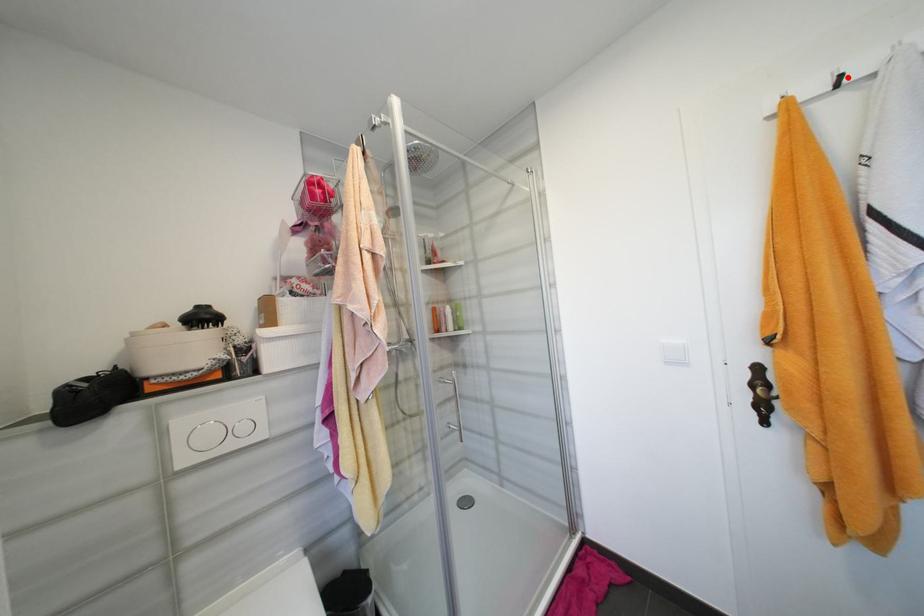
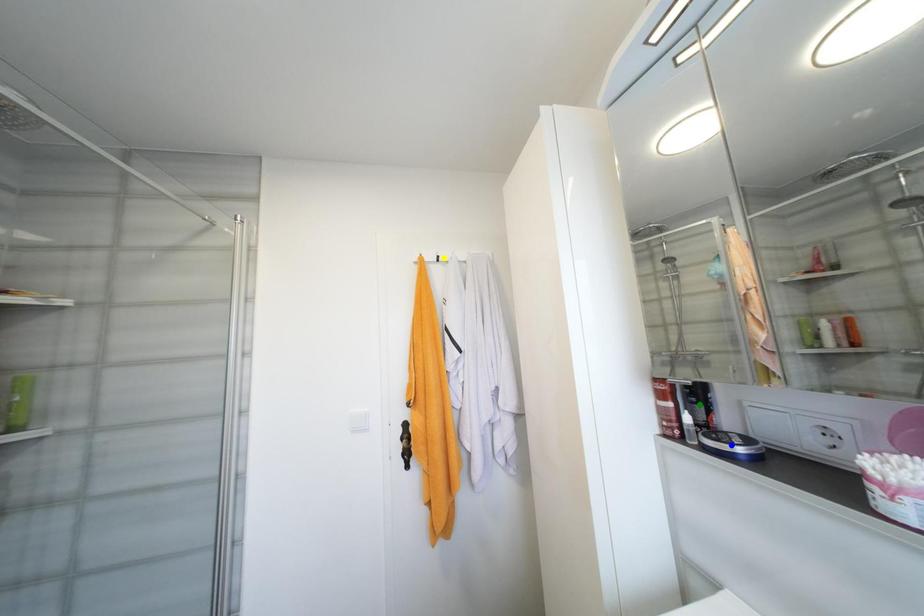
Question: I am providing you with two images of the same scene from different viewpoints. A red point is marked on the first image. You are given multiple points on the second image. Which spot in image 2 lines up with the point in image 1?

Choices:
 (A) yellow point
 (B) blue point
 (C) green point

Answer: (A)